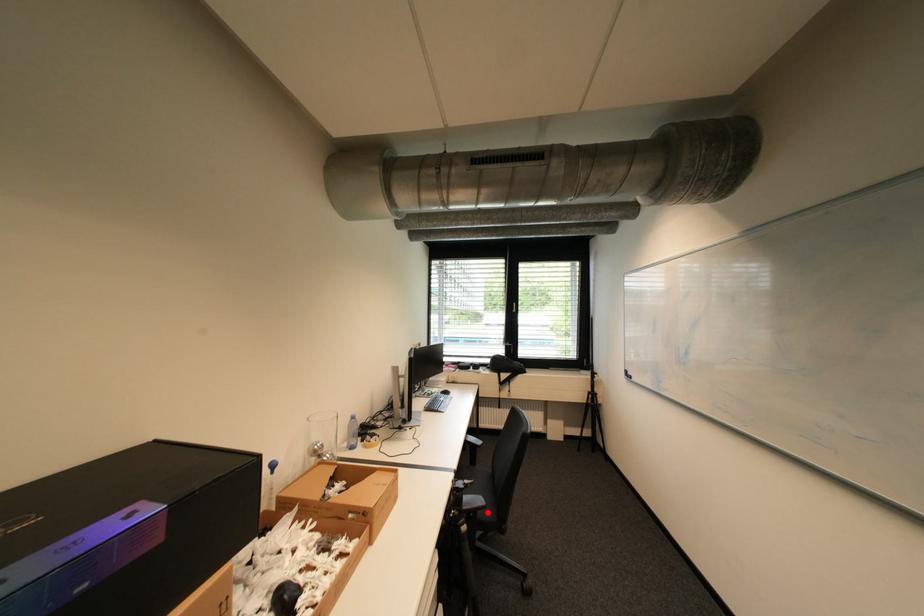
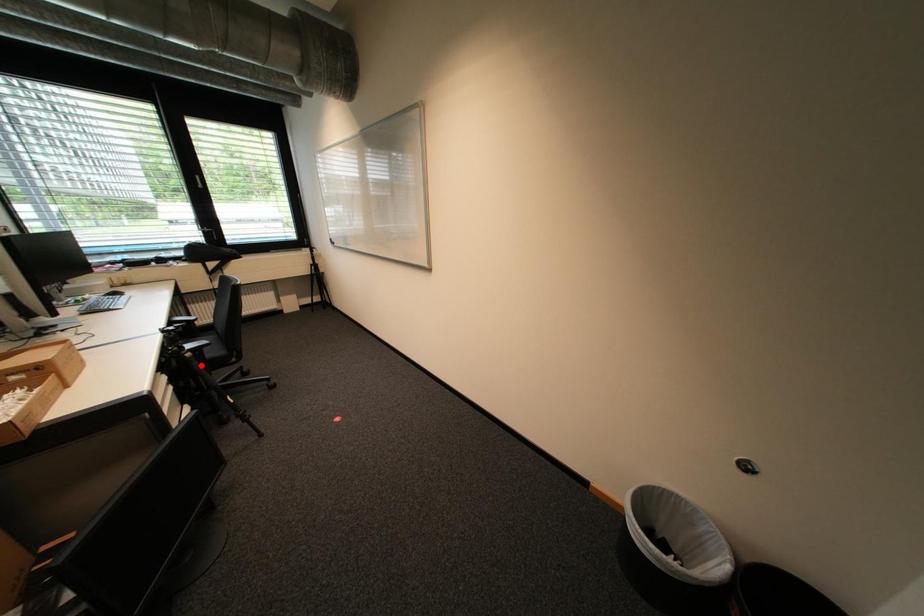
I am providing you with two images of the same scene from different viewpoints. A red point is marked on the first image and another point is marked on the second image. Is the marked point in image1 the same physical position as the marked point in image2?

No